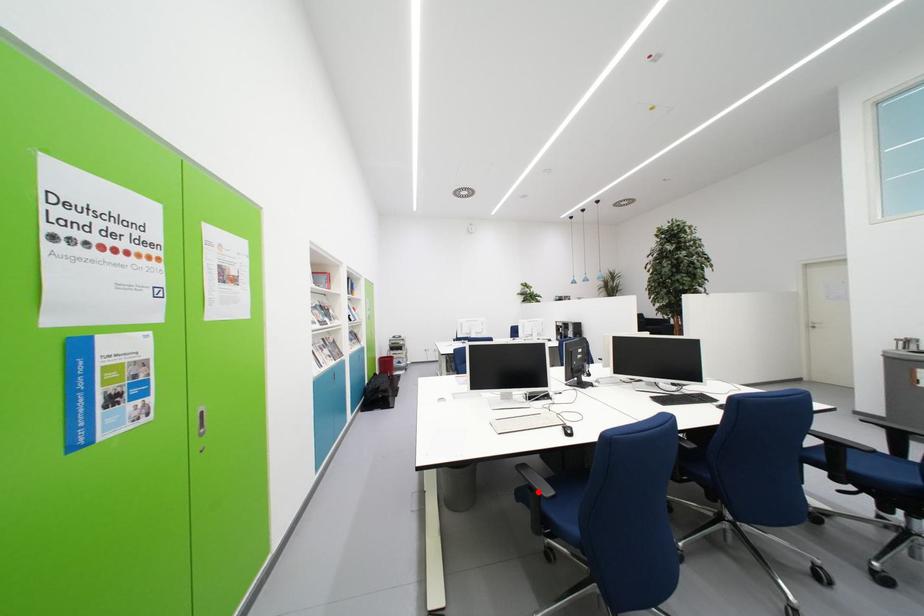
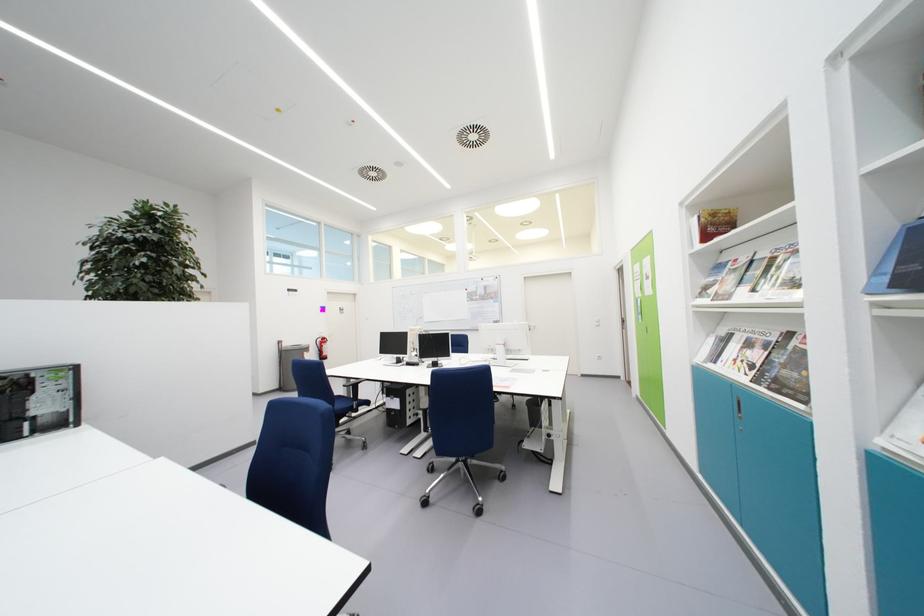
Question: I am providing you with two images of the same scene from different viewpoints. A red point is marked on the first image. At the location where the point appears in image 1, is it still visible in image 2?

Choices:
 (A) Yes
 (B) No

Answer: (B)